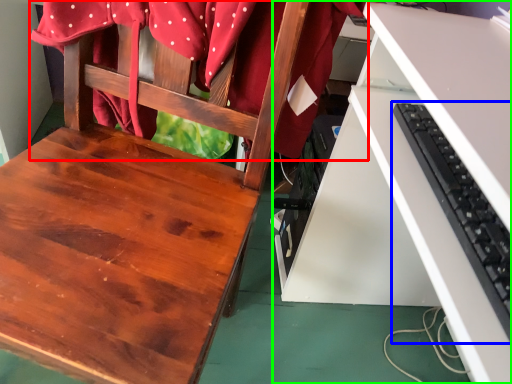
Question: Which is nearer to the fabric (highlighted by a red box)? computer keyboard (highlighted by a blue box) or desk (highlighted by a green box).

Choices:
 (A) computer keyboard
 (B) desk

Answer: (B)